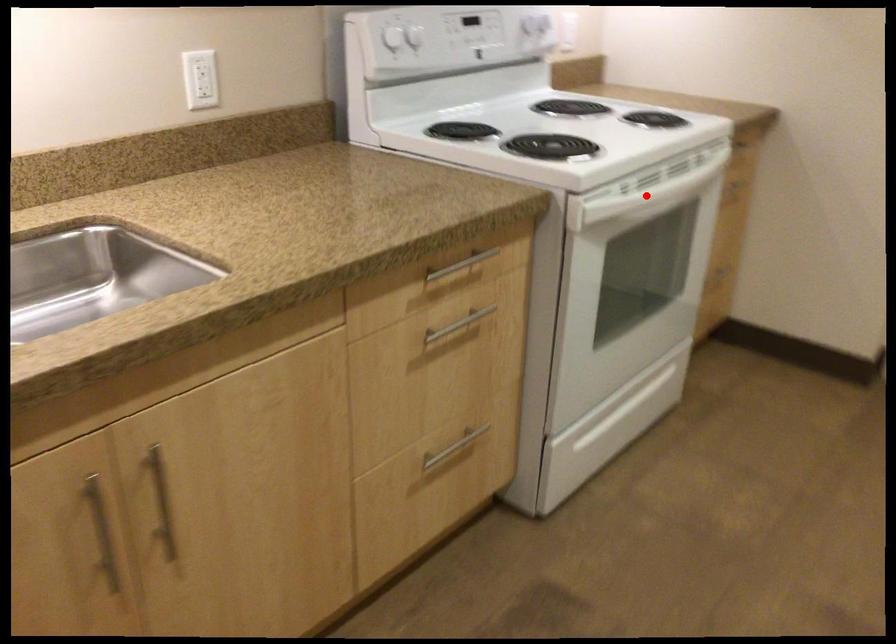
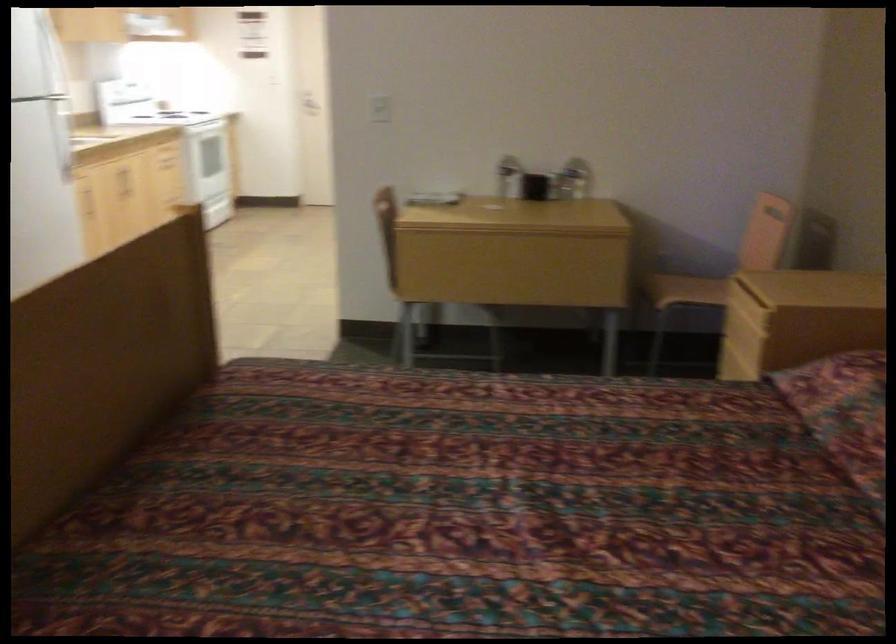
Question: I am providing you with two images of the same scene from different viewpoints. A red point is marked on the first image. At the location where the point appears in image 1, is it still visible in image 2?

Choices:
 (A) Yes
 (B) No

Answer: (B)